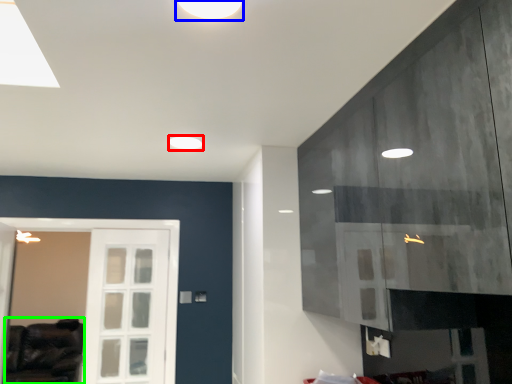
Question: Which object is positioned closest to lighting (highlighted by a red box)? Select from lighting (highlighted by a blue box) and furniture (highlighted by a green box).

Choices:
 (A) lighting
 (B) furniture

Answer: (A)